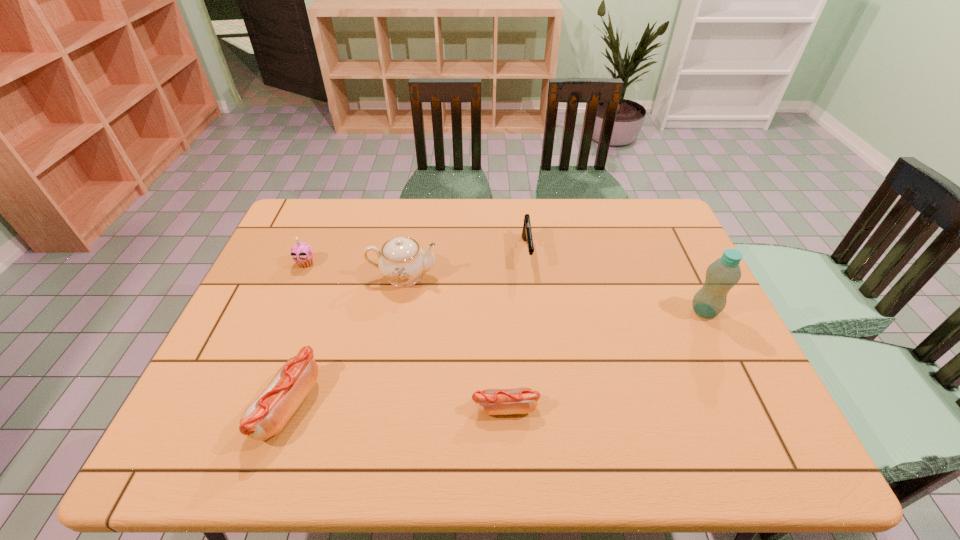
Please point a spot to add another sausage on the right. Please provide its 2D coordinates. Your answer should be formatted as a tuple, i.e. [(x, y)], where the tuple contains the x and y coordinates of a point satisfying the conditions above.

[(724, 410)]